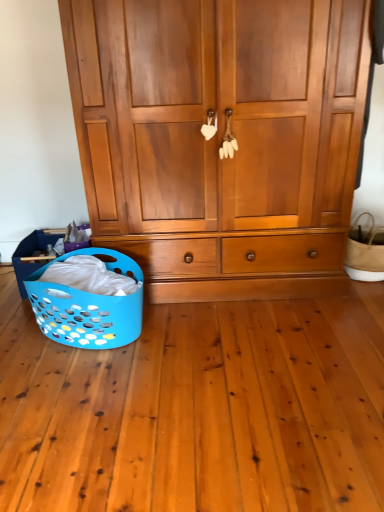
Question: From a real-world perspective, is blue plastic laundry basket at lower left, placed as the 2th basket when sorted from right to left, physically above wooden wardrobe at center?

Choices:
 (A) yes
 (B) no

Answer: (B)

Question: Does blue plastic laundry basket at lower left, placed as the 2th basket when sorted from right to left, have a greater width compared to wooden wardrobe at center?

Choices:
 (A) yes
 (B) no

Answer: (B)

Question: Is blue plastic laundry basket at lower left, the 1th basket when ordered from left to right, to the left of wooden wardrobe at center from the viewer's perspective?

Choices:
 (A) no
 (B) yes

Answer: (B)

Question: Would you consider blue plastic laundry basket at lower left, placed as the 2th basket when sorted from right to left, to be distant from wooden wardrobe at center?

Choices:
 (A) yes
 (B) no

Answer: (B)

Question: Is wooden wardrobe at center surrounded by blue plastic laundry basket at lower left, the 1th basket when ordered from left to right?

Choices:
 (A) no
 (B) yes

Answer: (A)

Question: Is blue plastic laundry basket at lower left, placed as the 2th basket when sorted from right to left, taller than wooden wardrobe at center?

Choices:
 (A) yes
 (B) no

Answer: (B)

Question: Is natural woven basket at right, arranged as the 1th basket when viewed from the right, outside wooden wardrobe at center?

Choices:
 (A) no
 (B) yes

Answer: (B)

Question: Does natural woven basket at right, arranged as the 1th basket when viewed from the right, have a larger size compared to wooden wardrobe at center?

Choices:
 (A) yes
 (B) no

Answer: (B)

Question: Does natural woven basket at right, acting as the second basket starting from the left, turn towards wooden wardrobe at center?

Choices:
 (A) yes
 (B) no

Answer: (B)

Question: Is natural woven basket at right, acting as the second basket starting from the left, smaller than wooden wardrobe at center?

Choices:
 (A) yes
 (B) no

Answer: (A)

Question: From a real-world perspective, is natural woven basket at right, arranged as the 1th basket when viewed from the right, physically below wooden wardrobe at center?

Choices:
 (A) no
 (B) yes

Answer: (B)

Question: Is natural woven basket at right, arranged as the 1th basket when viewed from the right, next to wooden wardrobe at center?

Choices:
 (A) yes
 (B) no

Answer: (B)

Question: Is wooden wardrobe at center smaller than natural woven basket at right, acting as the second basket starting from the left?

Choices:
 (A) no
 (B) yes

Answer: (A)